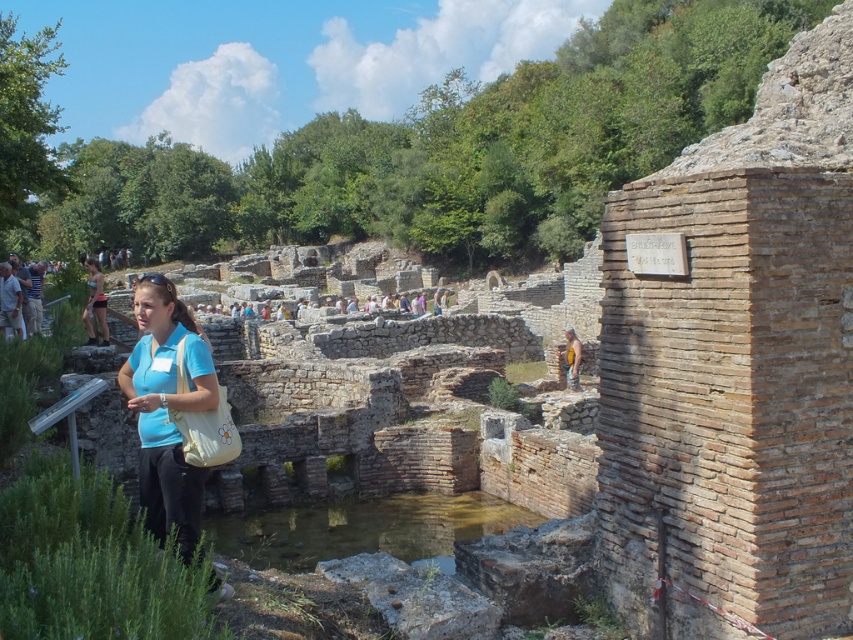
Between clear stone water at center and matte blue shirt at center, which one is positioned higher?

matte blue shirt at center is higher up.

Is clear stone water at center below matte blue shirt at center?

Correct, clear stone water at center is located below matte blue shirt at center.

The image size is (853, 640). Describe the element at coordinates (363, 529) in the screenshot. I see `clear stone water at center` at that location.

What are the coordinates of `clear stone water at center` in the screenshot? It's located at (363, 529).

Can you confirm if matte blue shirt at center is positioned to the left of matte black shorts at center?

No, matte blue shirt at center is not to the left of matte black shorts at center.

Is matte blue shirt at center smaller than matte black shorts at center?

Yes, matte blue shirt at center is smaller than matte black shorts at center.

The height and width of the screenshot is (640, 853). I want to click on matte blue shirt at center, so click(166, 410).

Measure the distance from clear stone water at center to matte black shorts at center.

25.77 meters

Between point (428, 504) and point (102, 285), which one is positioned behind?

The point (102, 285) is behind.

What do you see at coordinates (363, 529) in the screenshot? The height and width of the screenshot is (640, 853). I see `clear stone water at center` at bounding box center [363, 529].

Where is `clear stone water at center`? clear stone water at center is located at coordinates (363, 529).